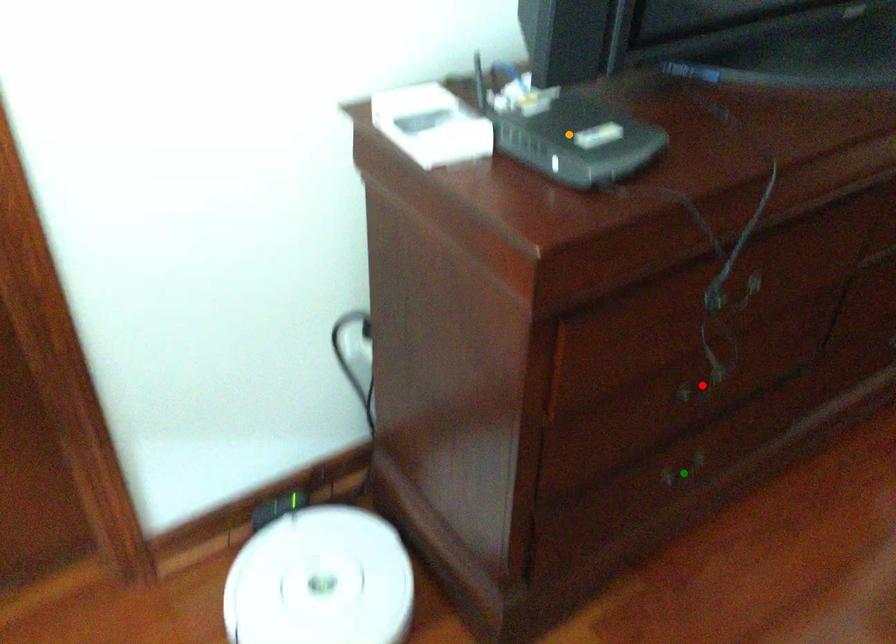
Order these from nearest to farthest:
1. orange point
2. green point
3. red point

orange point, red point, green point